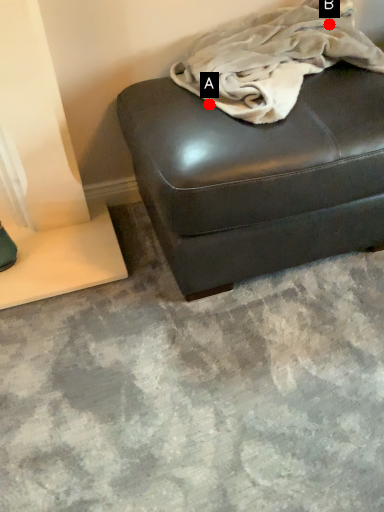
Question: Two points are circled on the image, labeled by A and B beside each circle. Which point is closer to the camera taking this photo?

Choices:
 (A) A is closer
 (B) B is closer

Answer: (A)